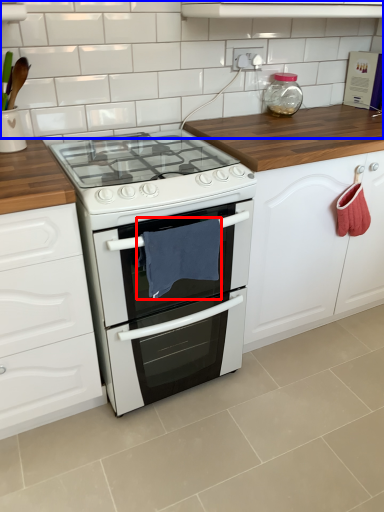
Question: Which of the following is the closest to the observer, material (highlighted by a red box) or tile (highlighted by a blue box)?

Choices:
 (A) material
 (B) tile

Answer: (A)